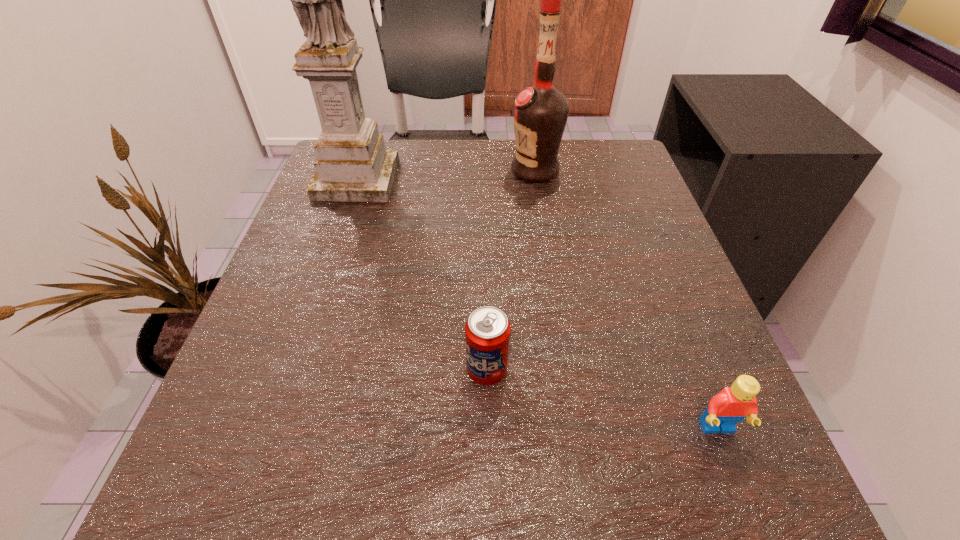
At what (x,y) coordinates should I click in order to perform the action: click on the leftmost object. Please return your answer as a coordinate pair (x, y). The width and height of the screenshot is (960, 540). Looking at the image, I should click on (352, 165).

Identify the location of sculpture. (352, 165).

The image size is (960, 540). In order to click on the third shortest object in this screenshot , I will do `click(540, 112)`.

Where is `liquor`? The height and width of the screenshot is (540, 960). liquor is located at coordinates (540, 112).

You are a GUI agent. You are given a task and a screenshot of the screen. Output one action in this format:
    pyautogui.click(x=<x>, y=<y>)
    Task: Click on the second object from left to right
    
    Given the screenshot: What is the action you would take?
    pyautogui.click(x=487, y=330)

At what (x,y) coordinates should I click in order to perform the action: click on soda can. Please return your answer as a coordinate pair (x, y). Looking at the image, I should click on (487, 330).

Image resolution: width=960 pixels, height=540 pixels. I want to click on the rightmost object, so click(x=732, y=404).

In order to click on Lego in this screenshot , I will do pyautogui.click(x=732, y=404).

Where is `vacant space situated 0.310m on the front-facing side of the sculpture`? The height and width of the screenshot is (540, 960). vacant space situated 0.310m on the front-facing side of the sculpture is located at coordinates (309, 318).

At what (x,y) coordinates should I click in order to perform the action: click on vacant space located on the front and back of the second object from right to left. Please return your answer as a coordinate pair (x, y). Looking at the image, I should click on (462, 170).